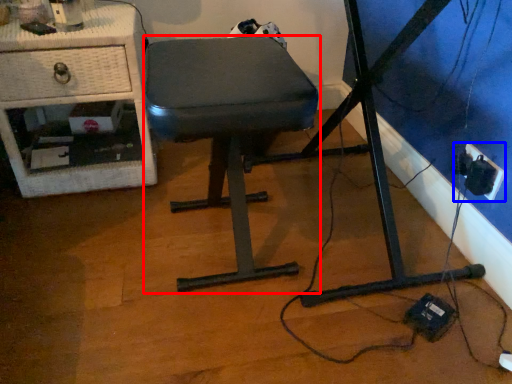
Question: Which object is closer to the camera taking this photo, stool (highlighted by a red box) or electric outlet (highlighted by a blue box)?

Choices:
 (A) stool
 (B) electric outlet

Answer: (A)